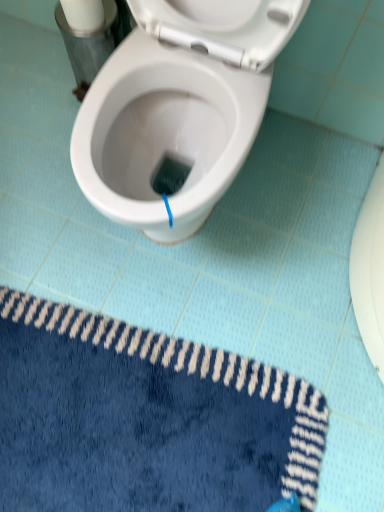
Image resolution: width=384 pixels, height=512 pixels. What do you see at coordinates (144, 419) in the screenshot?
I see `blue plush bath mat at lower left` at bounding box center [144, 419].

Measure the distance between blue plush bath mat at lower left and camera.

blue plush bath mat at lower left is 37.46 inches away from camera.

The height and width of the screenshot is (512, 384). Identify the location of blue plush bath mat at lower left. (144, 419).

What do you see at coordinates (83, 14) in the screenshot?
I see `white matte toilet paper at upper left` at bounding box center [83, 14].

This screenshot has width=384, height=512. I want to click on white matte toilet paper at upper left, so click(x=83, y=14).

Identify the location of blue plush bath mat at lower left. Image resolution: width=384 pixels, height=512 pixels. coord(144,419).

In the image, is white matte toilet paper at upper left on the left side or the right side of blue plush bath mat at lower left?

Clearly, white matte toilet paper at upper left is on the left of blue plush bath mat at lower left in the image.

Which object is further away from the camera taking this photo, white matte toilet paper at upper left or blue plush bath mat at lower left?

white matte toilet paper at upper left is behind.

Is point (94, 9) closer or farther from the camera than point (203, 507)?

Clearly, point (94, 9) is more distant from the camera than point (203, 507).

From the image's perspective, is white matte toilet paper at upper left positioned above or below blue plush bath mat at lower left?

Clearly, from the image's perspective, white matte toilet paper at upper left is above blue plush bath mat at lower left.

From a real-world perspective, between white matte toilet paper at upper left and blue plush bath mat at lower left, who is vertically higher?

white matte toilet paper at upper left.

Can you confirm if white matte toilet paper at upper left is wider than blue plush bath mat at lower left?

No, white matte toilet paper at upper left is not wider than blue plush bath mat at lower left.

Which of these two, white matte toilet paper at upper left or blue plush bath mat at lower left, stands shorter?

blue plush bath mat at lower left is shorter.

Does white matte toilet paper at upper left have a larger size compared to blue plush bath mat at lower left?

No.

Is white matte toilet paper at upper left spatially inside blue plush bath mat at lower left, or outside of it?

white matte toilet paper at upper left is not inside blue plush bath mat at lower left, it's outside.

Is there a large distance between white matte toilet paper at upper left and blue plush bath mat at lower left?

white matte toilet paper at upper left is near blue plush bath mat at lower left, not far away.

Is white matte toilet paper at upper left facing away from blue plush bath mat at lower left?

No, white matte toilet paper at upper left is not facing away from blue plush bath mat at lower left.

What's the angular difference between white matte toilet paper at upper left and blue plush bath mat at lower left's facing directions?

They differ by 95.3 degrees in their facing directions.

Measure the distance between white matte toilet paper at upper left and blue plush bath mat at lower left.

white matte toilet paper at upper left is 39.03 inches away from blue plush bath mat at lower left.

Where is `toilet paper lying behind the blue plush bath mat at lower left`? The image size is (384, 512). toilet paper lying behind the blue plush bath mat at lower left is located at coordinates (83, 14).

In the scene shown: Considering the relative positions of blue plush bath mat at lower left and white matte toilet paper at upper left in the image provided, is blue plush bath mat at lower left to the left or to the right of white matte toilet paper at upper left?

blue plush bath mat at lower left is positioned on white matte toilet paper at upper left's right side.

Which object is further away from the camera taking this photo, blue plush bath mat at lower left or white matte toilet paper at upper left?

white matte toilet paper at upper left is further away from the camera.

Considering the points (171, 508) and (61, 0), which point is behind, point (171, 508) or point (61, 0)?

The point (61, 0) is farther.

From the image's perspective, is blue plush bath mat at lower left positioned above or below white matte toilet paper at upper left?

blue plush bath mat at lower left is situated lower than white matte toilet paper at upper left in the image.

From a real-world perspective, is blue plush bath mat at lower left under white matte toilet paper at upper left?

Correct, in the physical world, blue plush bath mat at lower left is lower than white matte toilet paper at upper left.

Based on the photo, which object is thinner, blue plush bath mat at lower left or white matte toilet paper at upper left?

With smaller width is white matte toilet paper at upper left.

From their relative heights in the image, would you say blue plush bath mat at lower left is taller or shorter than white matte toilet paper at upper left?

blue plush bath mat at lower left is shorter than white matte toilet paper at upper left.

Between blue plush bath mat at lower left and white matte toilet paper at upper left, which one has smaller size?

With smaller size is white matte toilet paper at upper left.

Is blue plush bath mat at lower left inside or outside of white matte toilet paper at upper left?

The correct answer is: outside.

Are blue plush bath mat at lower left and white matte toilet paper at upper left located far from each other?

No, blue plush bath mat at lower left is in close proximity to white matte toilet paper at upper left.

Is white matte toilet paper at upper left at the back of blue plush bath mat at lower left?

blue plush bath mat at lower left is not turned away from white matte toilet paper at upper left.

How distant is blue plush bath mat at lower left from white matte toilet paper at upper left?

A distance of 39.03 inches exists between blue plush bath mat at lower left and white matte toilet paper at upper left.

This screenshot has height=512, width=384. What are the coordinates of `toilet paper behind the blue plush bath mat at lower left` in the screenshot? It's located at (83, 14).

What are the coordinates of `bath mat on the right of white matte toilet paper at upper left` in the screenshot? It's located at (144, 419).

Locate an element on the screen. bath mat in front of the white matte toilet paper at upper left is located at coordinates (144, 419).